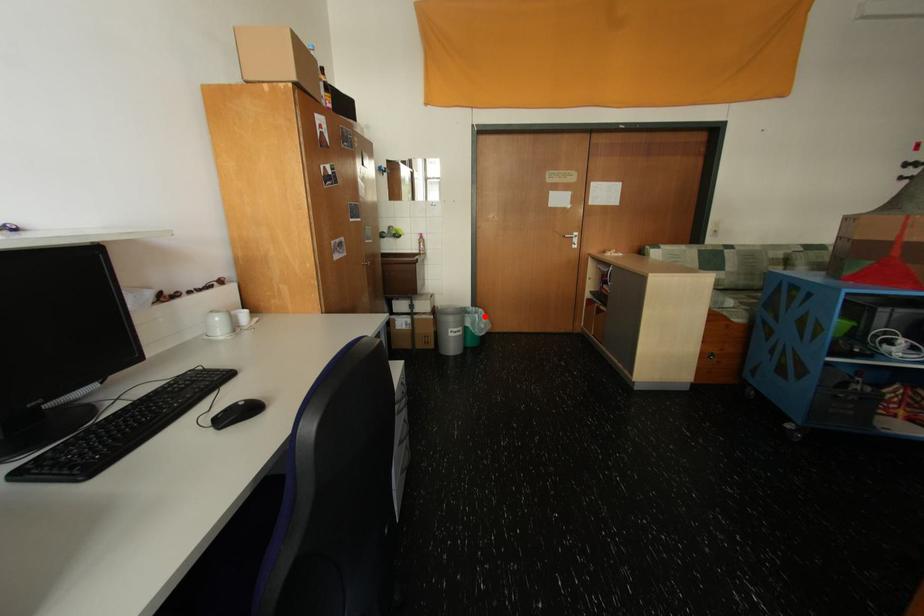
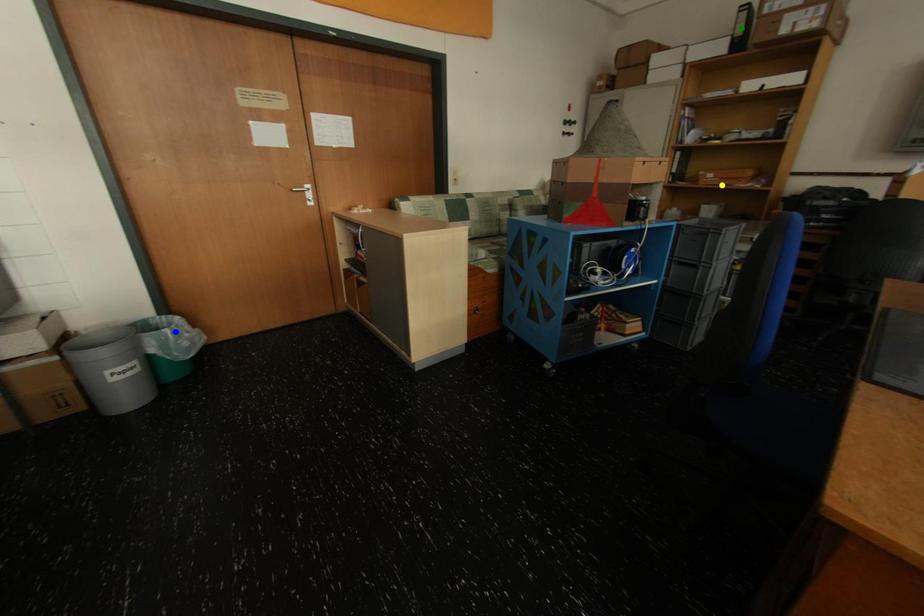
Question: I am providing you with two images of the same scene from different viewpoints. A red point is marked on the first image. You are given multiple points on the second image. Which point in image 2 represents the same 3d spot as the red point in image 1?

Choices:
 (A) yellow point
 (B) green point
 (C) blue point

Answer: (C)